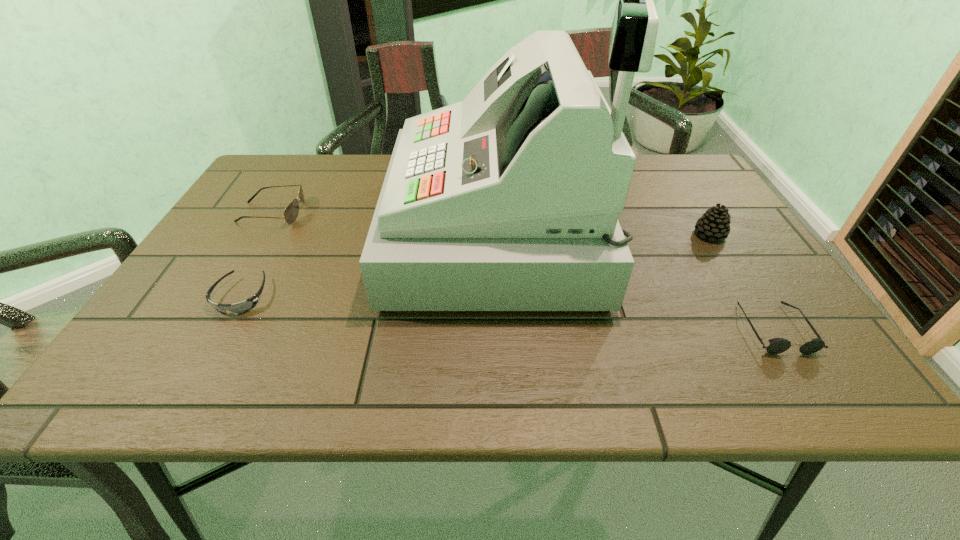
This screenshot has height=540, width=960. What are the coordinates of `the third object from right to left` in the screenshot? It's located at (509, 200).

Locate an element on the screen. cash register is located at coordinates (509, 200).

At what (x,y) coordinates should I click in order to perform the action: click on pinecone. Please return your answer as a coordinate pair (x, y). The width and height of the screenshot is (960, 540). Looking at the image, I should click on (714, 224).

Where is `the tallest sunglasses`? The image size is (960, 540). the tallest sunglasses is located at coordinates (291, 212).

Where is `the third tallest object`? The image size is (960, 540). the third tallest object is located at coordinates (291, 212).

At what (x,y) coordinates should I click in order to perform the action: click on the second tallest sunglasses. Please return your answer as a coordinate pair (x, y). Image resolution: width=960 pixels, height=540 pixels. Looking at the image, I should click on (777, 345).

Locate an element on the screen. The height and width of the screenshot is (540, 960). the second shortest object is located at coordinates (777, 345).

Where is `the shortest sunglasses`? the shortest sunglasses is located at coordinates (244, 306).

Where is `free space located on the keypad side of the cash register`? The width and height of the screenshot is (960, 540). free space located on the keypad side of the cash register is located at coordinates (363, 234).

This screenshot has width=960, height=540. I want to click on free space located 0.140m on the keypad side of the cash register, so coord(335,234).